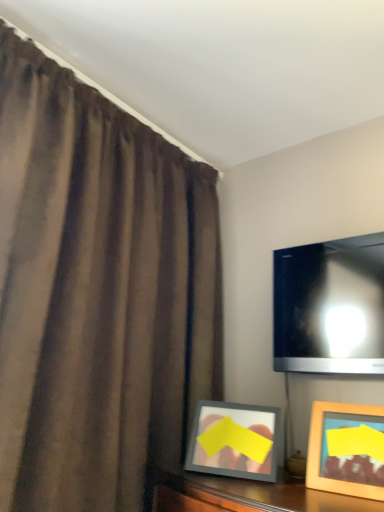
In order to click on wooden picture frame at lower right in this screenshot , I will do `click(346, 449)`.

What do you see at coordinates (346, 449) in the screenshot?
I see `wooden picture frame at lower right` at bounding box center [346, 449].

Where is `matte black tv at upper right`? matte black tv at upper right is located at coordinates (330, 307).

Between matte black tv at upper right and wooden picture frame at lower right, which one appears on the right side from the viewer's perspective?

matte black tv at upper right is more to the right.

Consider the image. Considering the relative sizes of matte black tv at upper right and wooden picture frame at lower right in the image provided, is matte black tv at upper right smaller than wooden picture frame at lower right?

No, matte black tv at upper right is not smaller than wooden picture frame at lower right.

Is point (375, 301) positioned in front of point (380, 409)?

That is False.

Are brown matte curtain at left and wooden picture frame at lower right located far from each other?

That's not correct — brown matte curtain at left is a little close to wooden picture frame at lower right.

From their relative heights in the image, would you say brown matte curtain at left is taller or shorter than wooden picture frame at lower right?

Clearly, brown matte curtain at left is taller compared to wooden picture frame at lower right.

You are a GUI agent. You are given a task and a screenshot of the screen. Output one action in this format:
    pyautogui.click(x=<x>, y=<y>)
    Task: Click on the curtain in front of the wooden picture frame at lower right
    
    Given the screenshot: What is the action you would take?
    pyautogui.click(x=96, y=293)

Between point (43, 270) and point (324, 409), which one is positioned behind?

The point (324, 409) is farther from the camera.

Can you confirm if wooden picture frame at lower right is smaller than brown matte curtain at left?

Indeed, wooden picture frame at lower right has a smaller size compared to brown matte curtain at left.

Based on the photo, what's the angular difference between wooden picture frame at lower right and brown matte curtain at left's facing directions?

The angle between the facing direction of wooden picture frame at lower right and the facing direction of brown matte curtain at left is 80 degrees.

Does wooden picture frame at lower right lie behind brown matte curtain at left?

Yes, wooden picture frame at lower right is further from the viewer.

Is wooden picture frame at lower right aimed at brown matte curtain at left?

No, wooden picture frame at lower right is not aimed at brown matte curtain at left.

How many degrees apart are the facing directions of matte black tv at upper right and brown matte curtain at left?

The facing directions of matte black tv at upper right and brown matte curtain at left are 89.7 degrees apart.

From the image's perspective, which is above, matte black tv at upper right or brown matte curtain at left?

brown matte curtain at left appears higher in the image.

Considering the relative sizes of matte black tv at upper right and brown matte curtain at left in the image provided, is matte black tv at upper right smaller than brown matte curtain at left?

Correct, matte black tv at upper right occupies less space than brown matte curtain at left.

Is point (381, 240) positioned behind point (65, 467)?

That is True.

In terms of width, does wooden picture frame at lower right look wider or thinner when compared to matte black tv at upper right?

Clearly, wooden picture frame at lower right has more width compared to matte black tv at upper right.

Who is more distant, wooden picture frame at lower right or matte black tv at upper right?

matte black tv at upper right is further from the camera.

How much distance is there between wooden picture frame at lower right and matte black tv at upper right?

wooden picture frame at lower right is 35.27 centimeters from matte black tv at upper right.

Is wooden picture frame at lower right in contact with matte black tv at upper right?

They are not placed beside each other.

Between brown matte curtain at left and matte black tv at upper right, which one is positioned behind?

matte black tv at upper right is further from the camera.

From the image's perspective, between brown matte curtain at left and matte black tv at upper right, which one is located above?

brown matte curtain at left.

This screenshot has height=512, width=384. Find the location of `curtain on the left of the matte black tv at upper right`. curtain on the left of the matte black tv at upper right is located at coordinates (96, 293).

This screenshot has width=384, height=512. I want to click on television above the wooden picture frame at lower right (from a real-world perspective), so click(330, 307).

I want to click on picture frame behind the brown matte curtain at left, so click(x=346, y=449).

From the image, which object appears to be farther from brown matte curtain at left, wooden picture frame at lower right or matte black tv at upper right?

wooden picture frame at lower right lies further to brown matte curtain at left than the other object.

Estimate the real-world distances between objects in this image. Which object is further from matte black tv at upper right, wooden picture frame at lower right or brown matte curtain at left?

brown matte curtain at left is positioned further to the anchor matte black tv at upper right.

When comparing their distances from wooden picture frame at lower right, does brown matte curtain at left or matte black tv at upper right seem further?

Answer: brown matte curtain at left.

Estimate the real-world distances between objects in this image. Which object is further from brown matte curtain at left, matte black tv at upper right or wooden picture frame at lower right?

Among the two, wooden picture frame at lower right is located further to brown matte curtain at left.

Looking at the image, which one is located further to wooden picture frame at lower right, matte black tv at upper right or brown matte curtain at left?

brown matte curtain at left lies further to wooden picture frame at lower right than the other object.

Which object lies nearer to the anchor point matte black tv at upper right, brown matte curtain at left or wooden picture frame at lower right?

wooden picture frame at lower right lies closer to matte black tv at upper right than the other object.

Identify the location of picture frame located between brown matte curtain at left and matte black tv at upper right in the left-right direction. The image size is (384, 512). (346, 449).